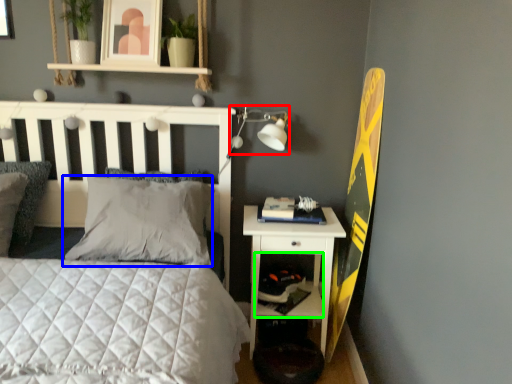
Question: Which is nearer to the table lamp (highlighted by a red box)? pillow (highlighted by a blue box) or shelf (highlighted by a green box).

Choices:
 (A) pillow
 (B) shelf

Answer: (A)